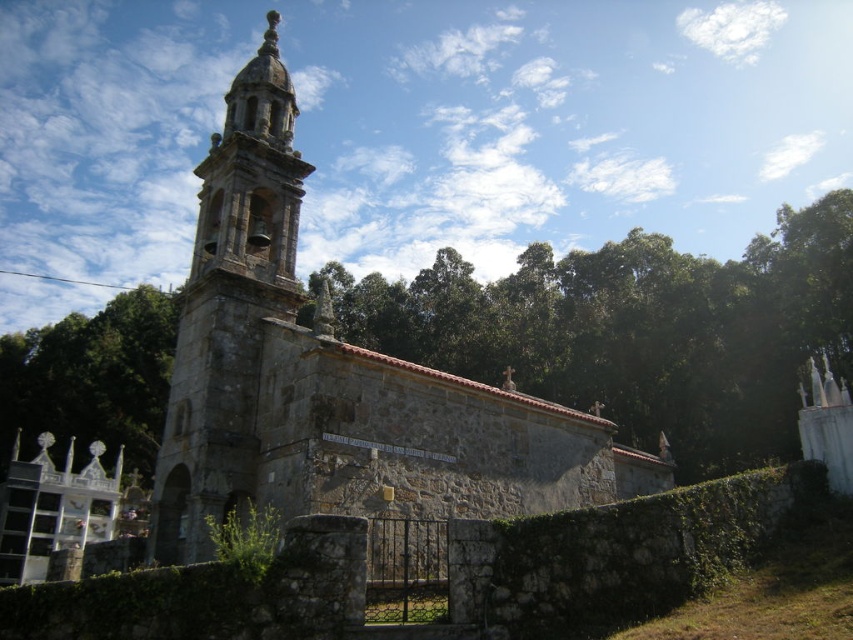
You are standing in front of the image and want to locate the stone church at center. What are the coordinates where you can find it?

The stone church at center can be found at coordinates point [335,380].

You are a photographer planning to capture the stone church at center and the green leafy trees at center in a single wide shot. Based on their sizes, which object would appear smaller in the photo?

The stone church at center would appear smaller in the photo because its width is less than that of the green leafy trees at center.

You are a visitor approaching the stone church at center. As you walk towards it, you notice the green leafy trees at center. Which object will appear larger in your view as you get closer?

The stone church at center will appear larger in your view as you get closer because it is positioned under the green leafy trees at center, meaning it is closer to you than the trees.